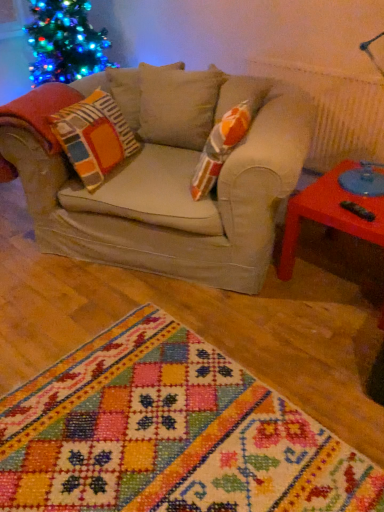
Locate an element on the screen. This screenshot has width=384, height=512. vacant space situated on the left part of rubberized plastic table at right is located at coordinates (251, 312).